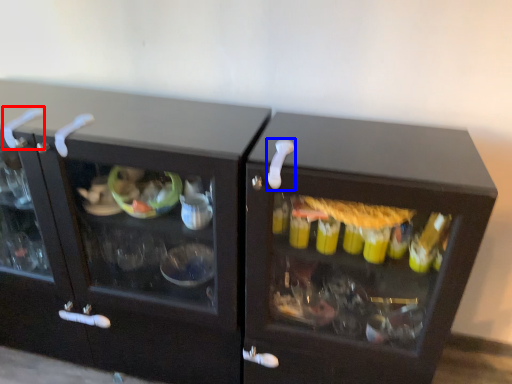
Question: Which object appears closest to the camera in this image, door handle (highlighted by a red box) or door handle (highlighted by a blue box)?

Choices:
 (A) door handle
 (B) door handle

Answer: (B)